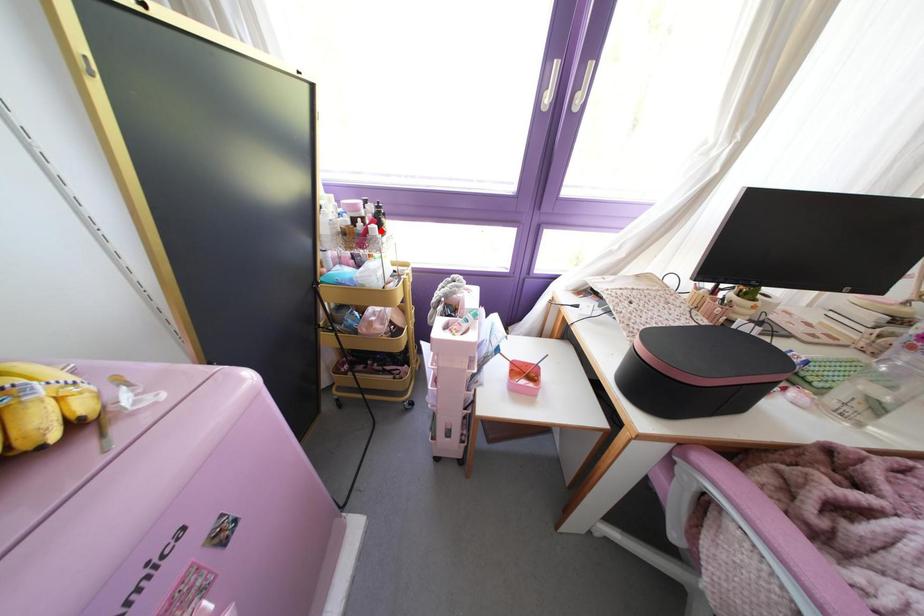
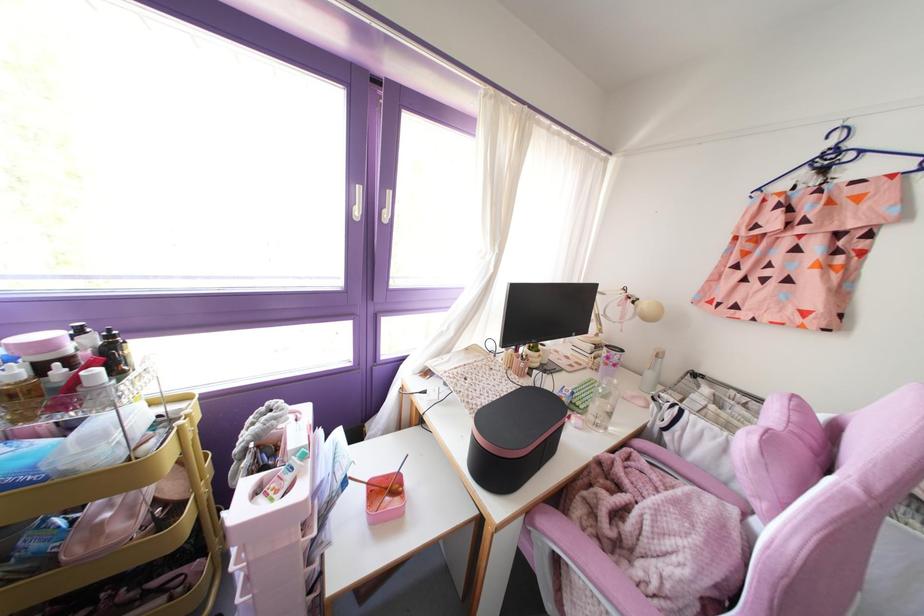
Locate, in the second image, the point that corresponds to the highlighted location in the first image.

(116, 373)